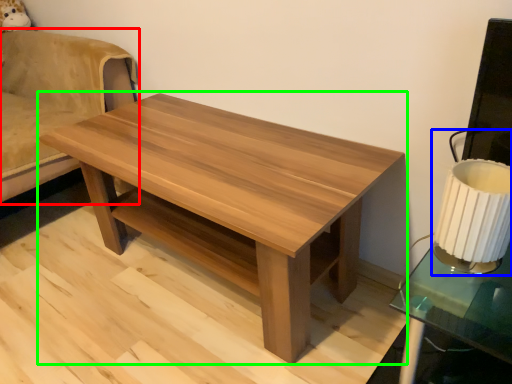
Question: Based on their relative distances, which object is farther from swivel chair (highlighted by a red box)? Choose from table lamp (highlighted by a blue box) and coffee table (highlighted by a green box).

Choices:
 (A) table lamp
 (B) coffee table

Answer: (A)